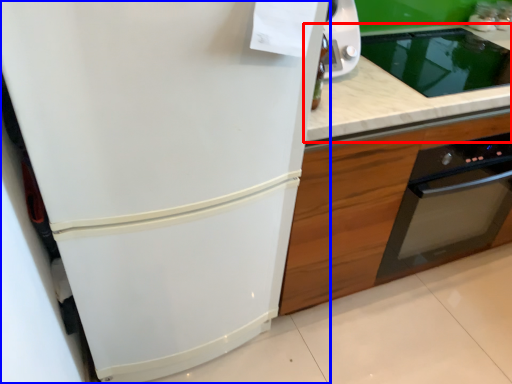
Question: Which point is closer to the camera, countertop (highlighted by a red box) or refrigerator (highlighted by a blue box)?

Choices:
 (A) countertop
 (B) refrigerator

Answer: (B)